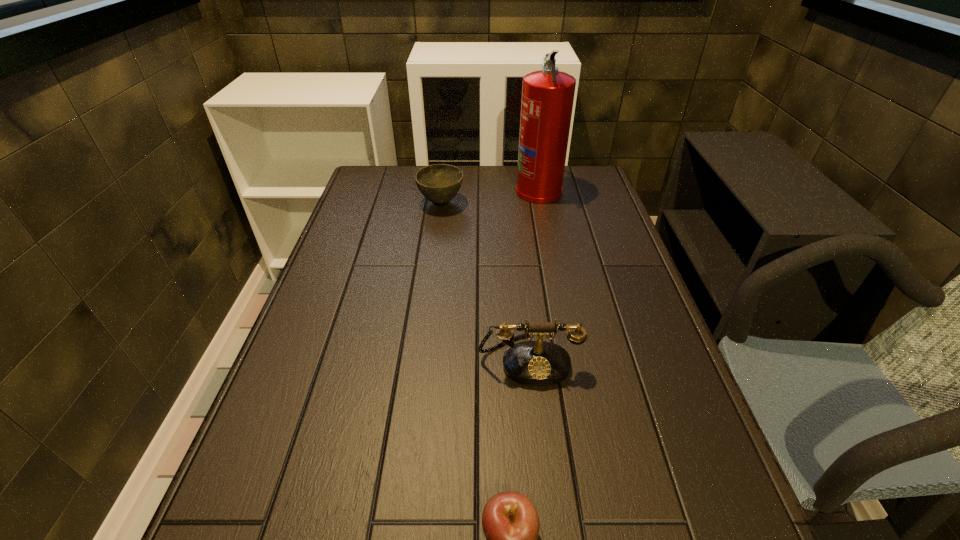
Where is `the tallest object`? Image resolution: width=960 pixels, height=540 pixels. the tallest object is located at coordinates (547, 100).

Find the location of a particular element. This screenshot has height=540, width=960. telephone is located at coordinates (535, 363).

Identify the location of the third shortest object. This screenshot has height=540, width=960. (535, 363).

Where is `bowl`? bowl is located at coordinates (439, 183).

This screenshot has width=960, height=540. Find the location of `the third tallest object`. the third tallest object is located at coordinates pyautogui.click(x=439, y=183).

Where is `free region located on the instruction side of the tallest object`? The image size is (960, 540). free region located on the instruction side of the tallest object is located at coordinates (483, 190).

Identify the location of free space located on the instruction side of the tallest object. 444,190.

Find the location of `free space located 0.320m on the instruction side of the tallest object`. free space located 0.320m on the instruction side of the tallest object is located at coordinates (421, 190).

This screenshot has width=960, height=540. Identify the location of free space located on the dial of the second tallest object. (540, 464).

Where is `vacant space located on the right of the bowl`? vacant space located on the right of the bowl is located at coordinates (557, 203).